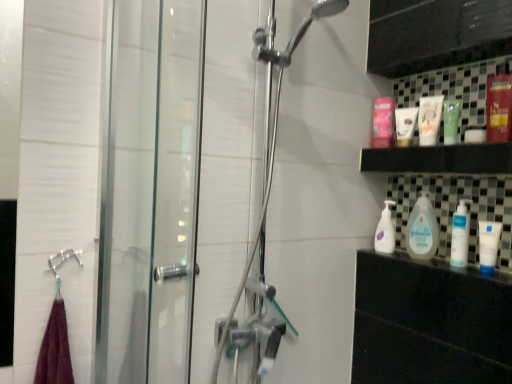
Question: From the image's perspective, is metallic red mouthwash at upper right, the first mouthwash positioned from the right, below matte white lotion at upper right, which is the first toiletry from front to back?

Choices:
 (A) yes
 (B) no

Answer: (B)

Question: Are metallic red mouthwash at upper right, arranged as the 1th mouthwash when viewed from the front, and matte white lotion at upper right, arranged as the 2th toiletry when viewed from the back, far apart?

Choices:
 (A) yes
 (B) no

Answer: (B)

Question: Is metallic red mouthwash at upper right, arranged as the 4th mouthwash when viewed from the left, positioned behind matte white lotion at upper right, which is the first toiletry from front to back?

Choices:
 (A) yes
 (B) no

Answer: (B)

Question: Would you say metallic red mouthwash at upper right, arranged as the 4th mouthwash when viewed from the left, is outside matte white lotion at upper right, which is the first toiletry from front to back?

Choices:
 (A) yes
 (B) no

Answer: (A)

Question: Does metallic red mouthwash at upper right, the first mouthwash positioned from the right, have a larger size compared to matte white lotion at upper right, arranged as the 2th toiletry when viewed from the back?

Choices:
 (A) no
 (B) yes

Answer: (B)

Question: Can you confirm if metallic red mouthwash at upper right, arranged as the 1th mouthwash when viewed from the front, is taller than matte white lotion at upper right, arranged as the 2th toiletry when viewed from the back?

Choices:
 (A) yes
 (B) no

Answer: (A)

Question: Does white glossy baby lotion at center, which appears as the first cleaning product when viewed from the back, have a lesser height compared to green matte tube at upper right, which ranks as the 2th mouthwash in right-to-left order?

Choices:
 (A) no
 (B) yes

Answer: (A)

Question: Can you confirm if white glossy baby lotion at center, which appears as the first cleaning product when viewed from the back, is wider than green matte tube at upper right, acting as the second mouthwash starting from the front?

Choices:
 (A) yes
 (B) no

Answer: (A)

Question: Does white glossy baby lotion at center, positioned as the second cleaning product in front-to-back order, come in front of green matte tube at upper right, which is the 3th mouthwash in back-to-front order?

Choices:
 (A) yes
 (B) no

Answer: (B)

Question: Is white glossy baby lotion at center, which appears as the first cleaning product when viewed from the back, facing away from green matte tube at upper right, which is the third mouthwash from left to right?

Choices:
 (A) yes
 (B) no

Answer: (B)

Question: Is white glossy baby lotion at center, which appears as the first cleaning product when viewed from the back, next to green matte tube at upper right, which is the third mouthwash from left to right, and touching it?

Choices:
 (A) no
 (B) yes

Answer: (A)

Question: Is white glossy baby lotion at center, positioned as the second cleaning product in front-to-back order, to the right of green matte tube at upper right, which ranks as the 2th mouthwash in right-to-left order, from the viewer's perspective?

Choices:
 (A) yes
 (B) no

Answer: (B)

Question: Is matte white tube at upper right, arranged as the first toiletry when viewed from the back, positioned behind white matte tube at right?

Choices:
 (A) yes
 (B) no

Answer: (A)